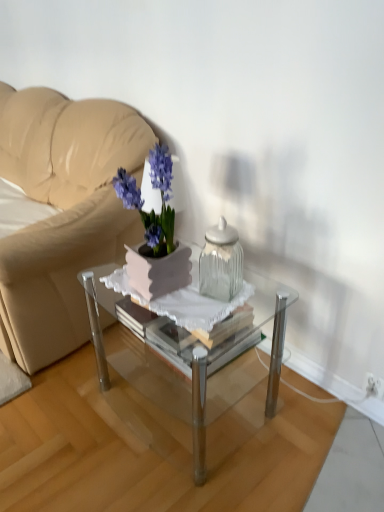
Question: Considering the positions of clear glass coffee table at center and white plastic electric outlet at lower right in the image, is clear glass coffee table at center taller or shorter than white plastic electric outlet at lower right?

Choices:
 (A) short
 (B) tall

Answer: (B)

Question: From a real-world perspective, is clear glass coffee table at center positioned above or below white plastic electric outlet at lower right?

Choices:
 (A) below
 (B) above

Answer: (B)

Question: Which is nearer to the white plastic electric outlet at lower right?

Choices:
 (A) clear glass coffee table at center
 (B) beige leather couch at upper left
 (C) clear glass jar at center
 (D) matte purple flower pot at center

Answer: (A)

Question: Estimate the real-world distances between objects in this image. Which object is farther from the beige leather couch at upper left?

Choices:
 (A) clear glass jar at center
 (B) clear glass coffee table at center
 (C) matte purple flower pot at center
 (D) white plastic electric outlet at lower right

Answer: (D)